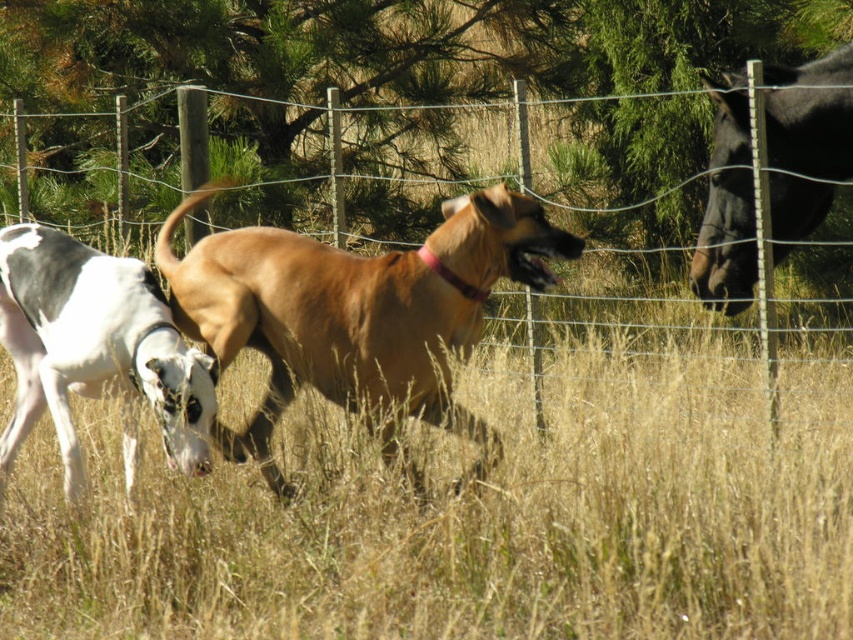
Question: Does sandy fur dog at center have a smaller size compared to wire mesh fence at center?

Choices:
 (A) yes
 (B) no

Answer: (B)

Question: Can you confirm if dry grass at center is positioned to the right of wire mesh fence at center?

Choices:
 (A) no
 (B) yes

Answer: (B)

Question: Which point is farther from the camera taking this photo?

Choices:
 (A) (538, 420)
 (B) (134, 301)
 (C) (287, 257)
 (D) (437, 595)

Answer: (A)

Question: Does sandy fur dog at center appear under white glossy dog at left?

Choices:
 (A) yes
 (B) no

Answer: (B)

Question: Which point is closer to the camera taking this photo?

Choices:
 (A) (753, 161)
 (B) (183, 458)
 (C) (311, 305)

Answer: (B)

Question: Which of the following is the farthest from the observer?

Choices:
 (A) (202, 148)
 (B) (299, 342)
 (C) (71, 248)
 (D) (831, 536)

Answer: (A)